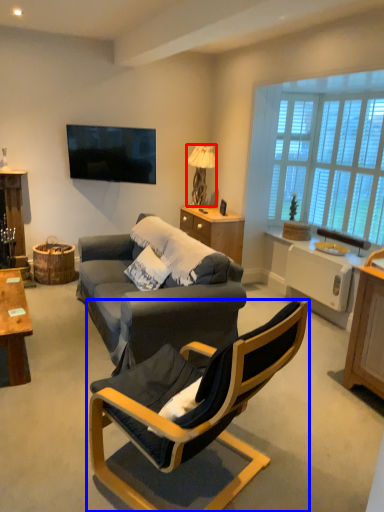
Question: Which point is further to the camera, lamp (highlighted by a red box) or chair (highlighted by a blue box)?

Choices:
 (A) lamp
 (B) chair

Answer: (A)